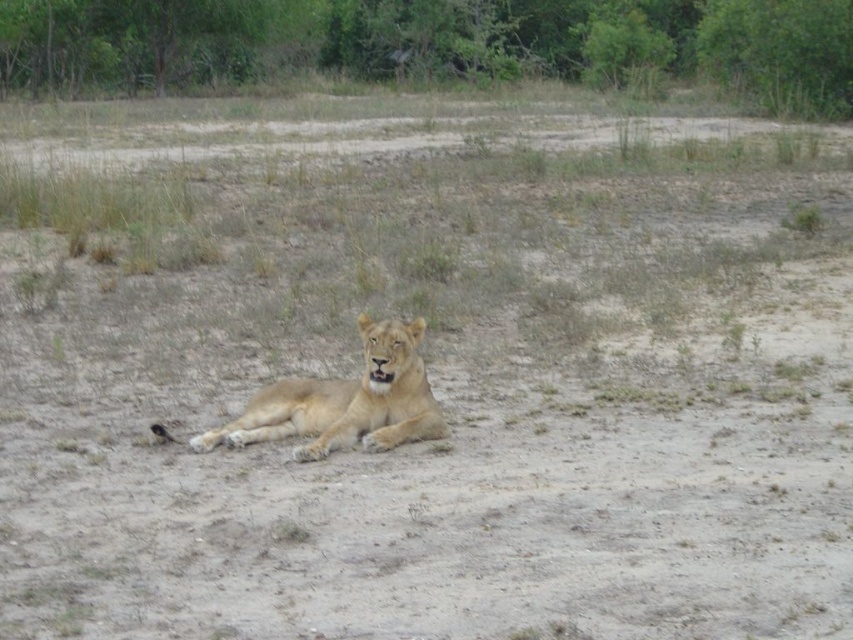
Does green leafy tree at upper center appear under golden fur lion at center?

No.

Who is more forward, [469,40] or [318,387]?

Point [318,387] is more forward.

Where is `green leafy tree at upper center`? The image size is (853, 640). green leafy tree at upper center is located at coordinates (433, 44).